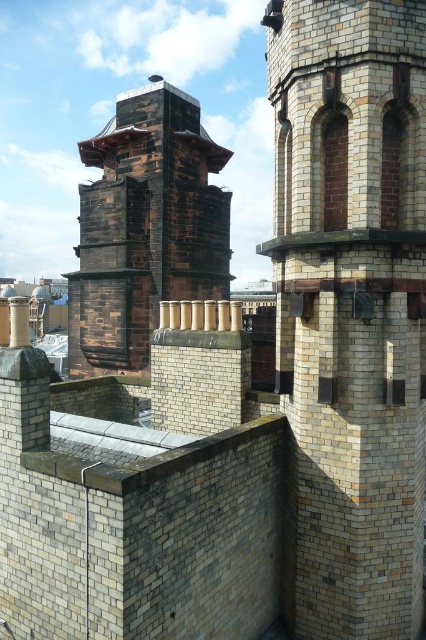
Does rustic brick chimney at center have a greater width compared to shiny metallic roof at upper center?

Yes, rustic brick chimney at center is wider than shiny metallic roof at upper center.

Does rustic brick chimney at center lie in front of shiny metallic roof at upper center?

Yes, it is.

In the scene shown: Measure the distance between rustic brick chimney at center and camera.

A distance of 17.13 meters exists between rustic brick chimney at center and camera.

At what (x,y) coordinates should I click in order to perform the action: click on rustic brick chimney at center. Please return your answer as a coordinate pair (x, y). The height and width of the screenshot is (640, 426). Looking at the image, I should click on (144, 227).

Based on the photo, which of these two, white brick tower at center or rustic brick chimney at center, stands shorter?

Standing shorter between the two is white brick tower at center.

Can you confirm if white brick tower at center is thinner than rustic brick chimney at center?

Indeed, white brick tower at center has a lesser width compared to rustic brick chimney at center.

Between point (356, 224) and point (195, 253), which one is positioned behind?

The point (195, 253) is more distant.

Identify the location of white brick tower at center. The width and height of the screenshot is (426, 640). (351, 307).

Which is more to the right, white brick tower at center or shiny metallic roof at upper center?

white brick tower at center

Is white brick tower at center shorter than shiny metallic roof at upper center?

No, white brick tower at center is not shorter than shiny metallic roof at upper center.

Between point (351, 460) and point (89, 145), which one is positioned behind?

The point (89, 145) is more distant.

Where is `white brick tower at center`? The width and height of the screenshot is (426, 640). white brick tower at center is located at coordinates (351, 307).